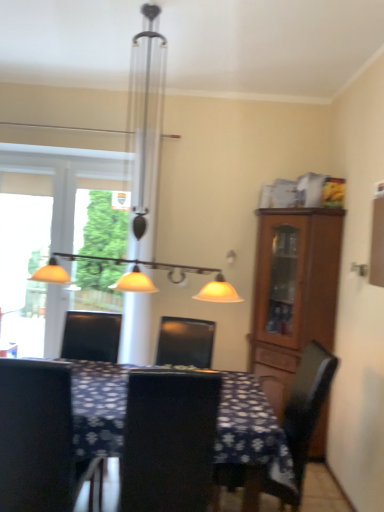
Locate an element on the screen. This screenshot has height=512, width=384. empty space that is ontop of matte metal chandelier at upper center (from a real-world perspective) is located at coordinates (122, 9).